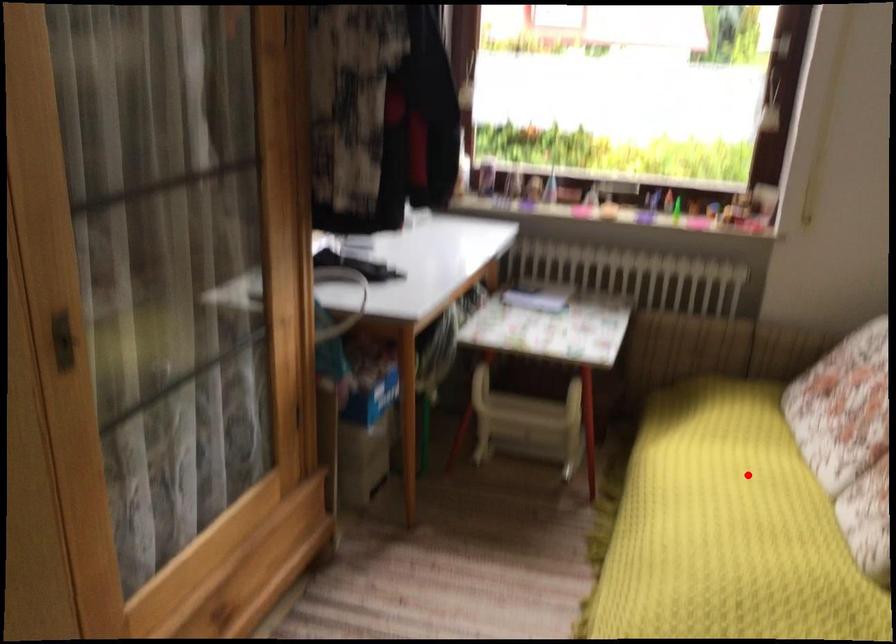
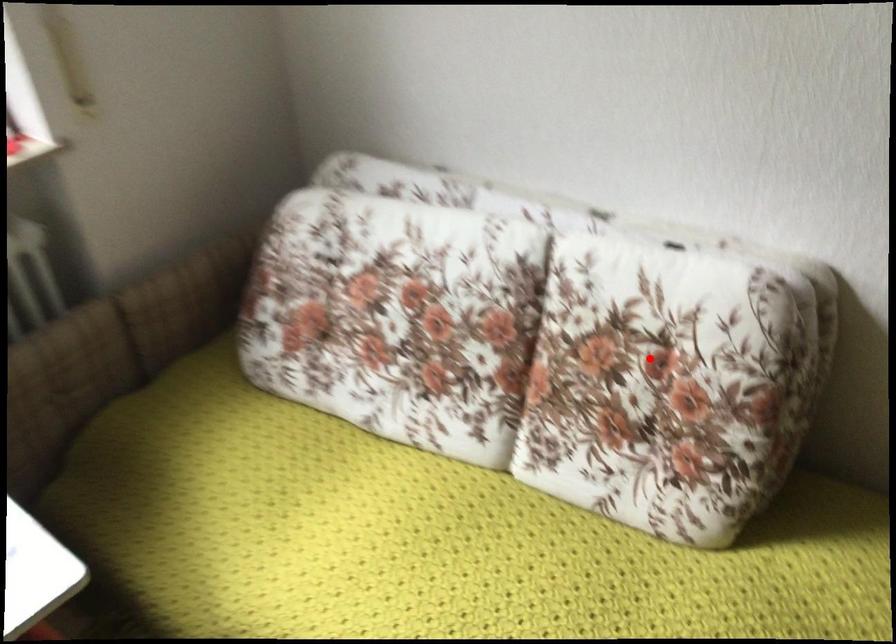
I am providing you with two images of the same scene from different viewpoints. A red point is marked on the first image and another point is marked on the second image. Is the marked point in image1 the same physical position as the marked point in image2?

No